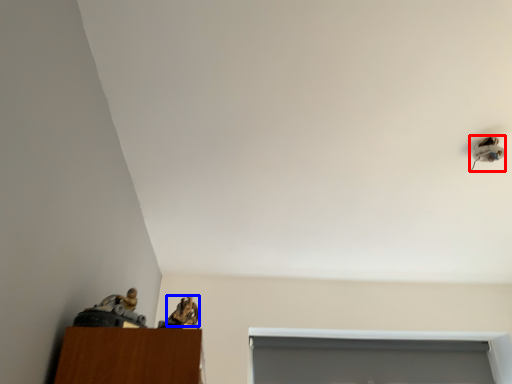
Question: Which object appears closest to the camera in this image, lamp (highlighted by a red box) or animal (highlighted by a blue box)?

Choices:
 (A) lamp
 (B) animal

Answer: (B)